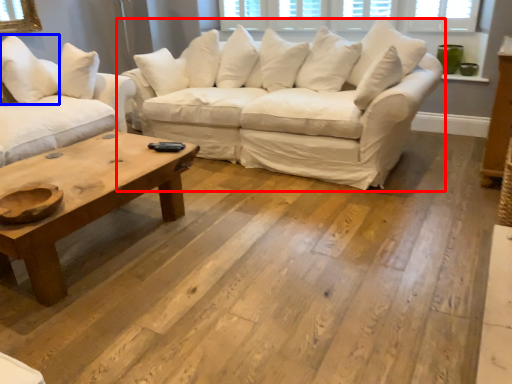
Question: Among these objects, which one is farthest to the camera, studio couch (highlighted by a red box) or pillow (highlighted by a blue box)?

Choices:
 (A) studio couch
 (B) pillow

Answer: (B)